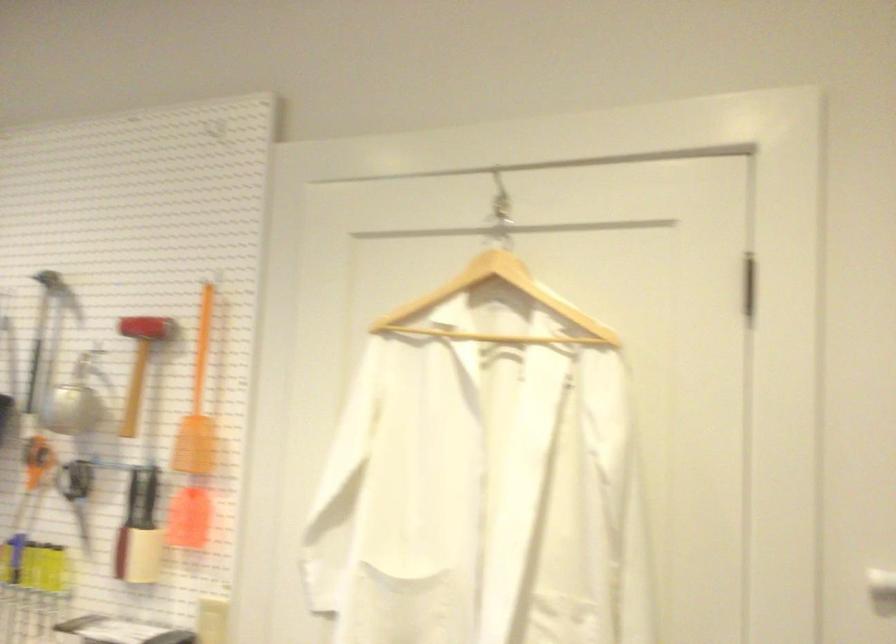
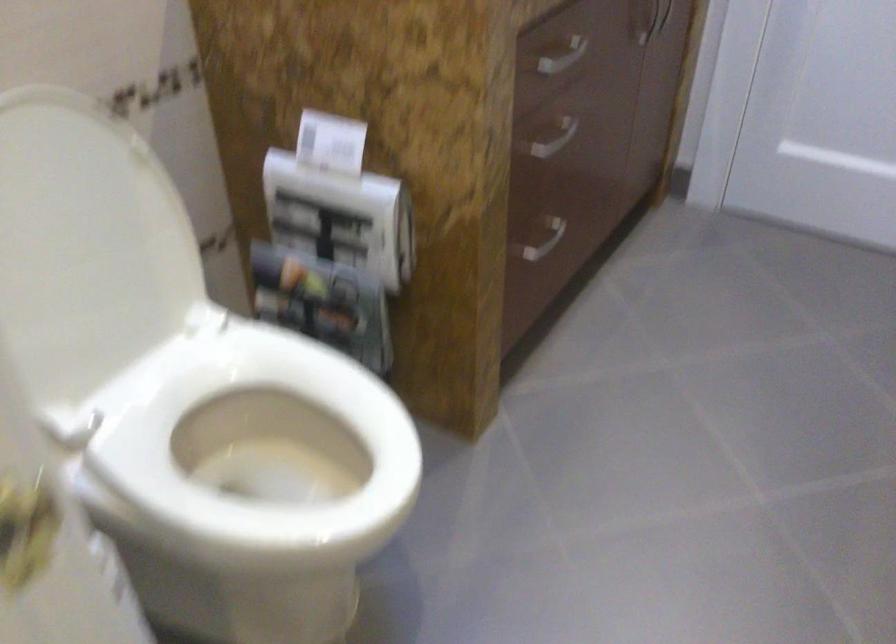
First-person continuous shooting, in which direction is the camera rotating?

The rotation direction of the camera is right-down.